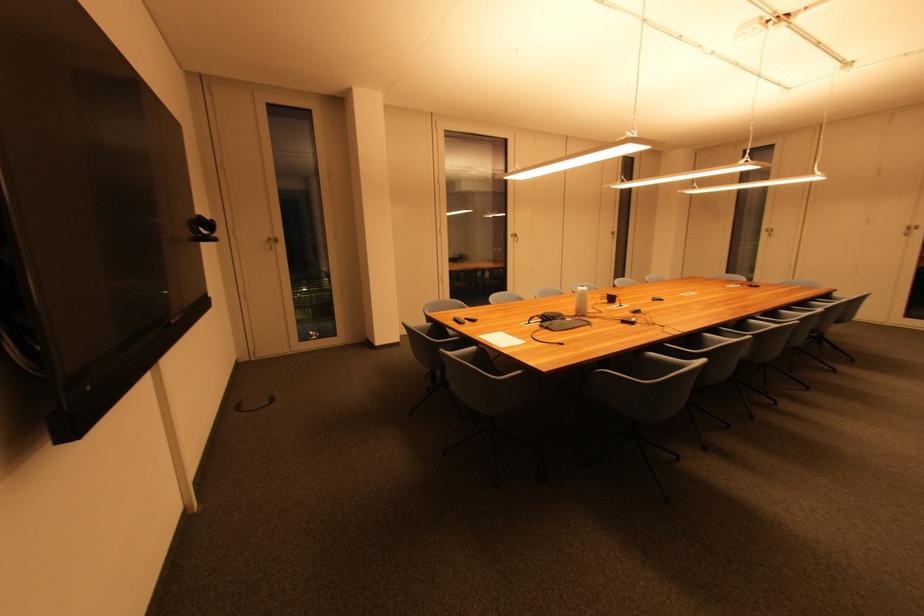
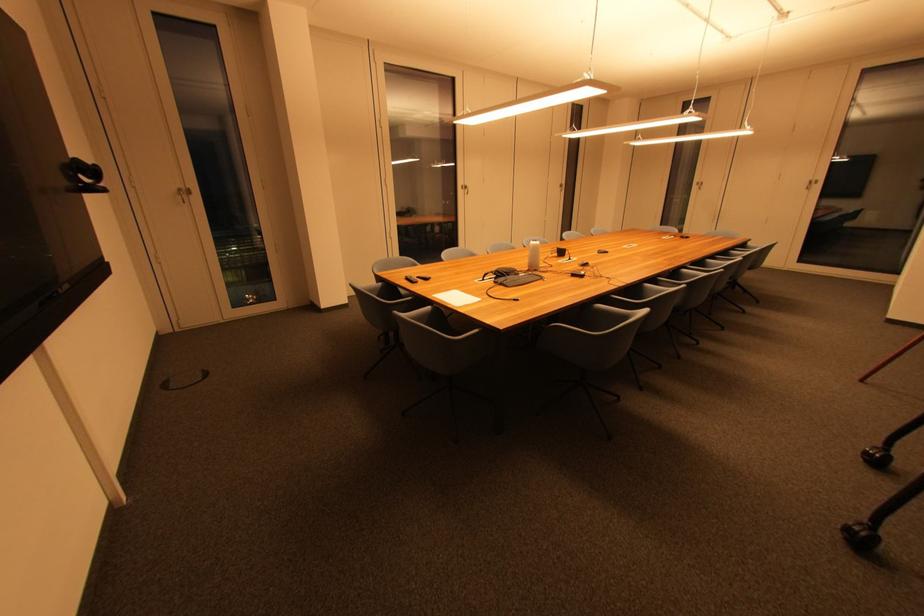
In the second image, find the point that corresponds to [434,326] in the first image.

(385, 286)